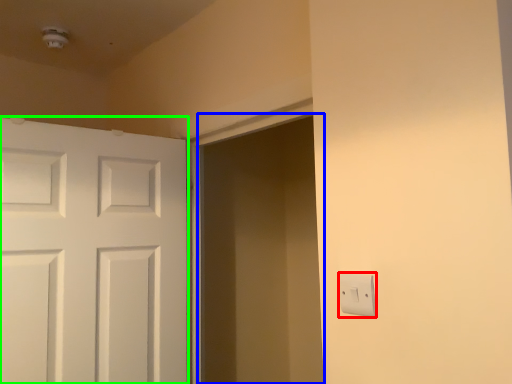
Question: Based on their relative distances, which object is nearer to light switch (highlighted by a red box)? Choose from screen door (highlighted by a blue box) and door (highlighted by a green box).

Choices:
 (A) screen door
 (B) door

Answer: (B)